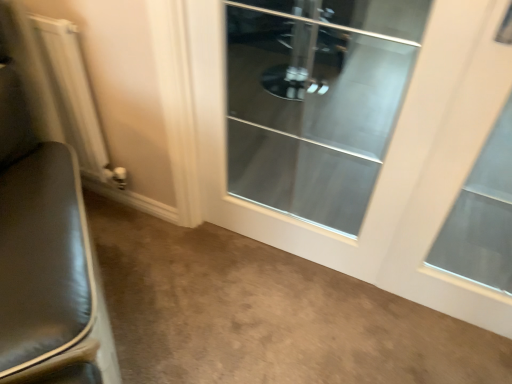
Identify the location of white metallic radiator at left. (75, 97).

This screenshot has width=512, height=384. Describe the element at coordinates (50, 276) in the screenshot. I see `black leather chair at left` at that location.

Image resolution: width=512 pixels, height=384 pixels. I want to click on black leather chair at left, so click(50, 276).

This screenshot has height=384, width=512. What are the coordinates of `transparent glass window at center` in the screenshot? It's located at (453, 160).

The height and width of the screenshot is (384, 512). What do you see at coordinates (316, 100) in the screenshot? I see `clear glass door at center` at bounding box center [316, 100].

Identify the location of white metallic radiator at left. (75, 97).

Is white metallic radiator at left smaller than clear glass door at center?

No.

Does point (66, 36) come farther from viewer compared to point (336, 205)?

No, (66, 36) is in front of (336, 205).

Is white metallic radiator at left oriented towards clear glass door at center?

No, white metallic radiator at left is not facing towards clear glass door at center.

Who is taller, clear glass door at center or white metallic radiator at left?

Result: clear glass door at center is taller.

Does clear glass door at center turn towards white metallic radiator at left?

No, clear glass door at center is not facing towards white metallic radiator at left.

Considering the relative positions of clear glass door at center and white metallic radiator at left in the image provided, is clear glass door at center to the right of white metallic radiator at left from the viewer's perspective?

Correct, you'll find clear glass door at center to the right of white metallic radiator at left.

Identify the location of screen door located above the clear glass door at center (from a real-world perspective). (316, 100).

Is clear glass door at center looking in the opposite direction of clear glass door at center?

Yes, clear glass door at center is at the back of clear glass door at center.

Would you say clear glass door at center is a long distance from clear glass door at center?

No, clear glass door at center is not far from clear glass door at center.

Is clear glass door at center located outside clear glass door at center?

That's incorrect, clear glass door at center is not completely outside clear glass door at center.

What's the angular difference between clear glass door at center and clear glass door at center's facing directions?

The angle between the facing direction of clear glass door at center and the facing direction of clear glass door at center is 0.00673 degrees.

In the scene shown: Considering the relative sizes of clear glass door at center and clear glass door at center in the image provided, is clear glass door at center bigger than clear glass door at center?

Incorrect, clear glass door at center is not larger than clear glass door at center.

Does point (303, 150) come in front of point (455, 184)?

No, it is not.

Does black leather chair at left appear on the right side of white metallic radiator at left?

Correct, you'll find black leather chair at left to the right of white metallic radiator at left.

Is point (58, 229) positioned after point (69, 42)?

No.

Is black leather chair at left located outside white metallic radiator at left?

Absolutely, black leather chair at left is external to white metallic radiator at left.

From a real-world perspective, relative to white metallic radiator at left, is black leather chair at left vertically above or below?

From a real-world perspective, black leather chair at left is physically above white metallic radiator at left.

Between clear glass door at center and black leather chair at left, which one has larger size?

black leather chair at left.

Between clear glass door at center and black leather chair at left, which one has larger width?

With larger width is black leather chair at left.

From the image's perspective, which is above, clear glass door at center or black leather chair at left?

clear glass door at center.

From the picture: From a real-world perspective, is clear glass door at center above or below black leather chair at left?

In terms of real-world spatial position, clear glass door at center is above black leather chair at left.

Is transparent glass window at center positioned beyond the bounds of white metallic radiator at left?

Yes, transparent glass window at center is located beyond the bounds of white metallic radiator at left.

Considering the relative sizes of transparent glass window at center and white metallic radiator at left in the image provided, is transparent glass window at center bigger than white metallic radiator at left?

Correct, transparent glass window at center is larger in size than white metallic radiator at left.

Considering their positions, is transparent glass window at center located in front of or behind white metallic radiator at left?

transparent glass window at center is in front of white metallic radiator at left.

In the image, is transparent glass window at center on the left side or the right side of white metallic radiator at left?

Based on their positions, transparent glass window at center is located to the right of white metallic radiator at left.

Identify the location of screen door above the white metallic radiator at left (from a real-world perspective). This screenshot has height=384, width=512. (316, 100).

Where is `door that is in front of the white metallic radiator at left`? This screenshot has width=512, height=384. door that is in front of the white metallic radiator at left is located at coordinates (384, 161).

Based on their spatial positions, is clear glass door at center or clear glass door at center further from white metallic radiator at left?

Based on the image, clear glass door at center appears to be further to white metallic radiator at left.

Considering their positions, is clear glass door at center positioned closer to black leather chair at left than white metallic radiator at left?

white metallic radiator at left.

Which object lies nearer to the anchor point white metallic radiator at left, clear glass door at center or black leather chair at left?

black leather chair at left lies closer to white metallic radiator at left than the other object.

Looking at the image, which one is located further to clear glass door at center, black leather chair at left or white metallic radiator at left?

black leather chair at left is positioned further to the anchor clear glass door at center.

Estimate the real-world distances between objects in this image. Which object is closer to black leather chair at left, transparent glass window at center or white metallic radiator at left?

white metallic radiator at left.

From the image, which object appears to be nearer to transparent glass window at center, clear glass door at center or black leather chair at left?

clear glass door at center is positioned closer to the anchor transparent glass window at center.

Based on the photo, from the image, which object appears to be farther from white metallic radiator at left, clear glass door at center or black leather chair at left?

Based on the image, clear glass door at center appears to be further to white metallic radiator at left.

Estimate the real-world distances between objects in this image. Which object is further from clear glass door at center, clear glass door at center or black leather chair at left?

clear glass door at center is positioned further to the anchor clear glass door at center.

This screenshot has width=512, height=384. What are the coordinates of `door between black leather chair at left and transparent glass window at center` in the screenshot? It's located at (384, 161).

Identify the location of screen door between black leather chair at left and white metallic radiator at left in the front-back direction. (316, 100).

What are the coordinates of `door positioned between black leather chair at left and white metallic radiator at left from near to far` in the screenshot? It's located at (384, 161).

Locate an element on the screen. This screenshot has width=512, height=384. screen door located between clear glass door at center and transparent glass window at center in the left-right direction is located at coordinates (x=316, y=100).